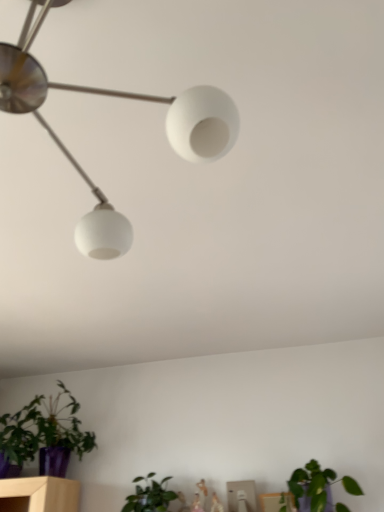
You are a GUI agent. You are given a task and a screenshot of the screen. Output one action in this format:
    pyautogui.click(x=<x>, y=<y>)
    Task: Click on the matte purple pot at lower left, positioned as the first houseplant in left-to-right order
    The width and height of the screenshot is (384, 512).
    Given the screenshot: What is the action you would take?
    pyautogui.click(x=44, y=434)

The image size is (384, 512). What do you see at coordinates (44, 434) in the screenshot? I see `matte purple pot at lower left, which is counted as the 2th houseplant, starting from the right` at bounding box center [44, 434].

Locate an element on the screen. green matte plant at lower right, the first houseplant from the right is located at coordinates (318, 486).

In order to face green matte plant at lower right, the first houseplant from the right, should I rotate leftwards or rightwards?

Rotate right and turn 16.566 degrees.

Image resolution: width=384 pixels, height=512 pixels. What do you see at coordinates (318, 486) in the screenshot?
I see `green matte plant at lower right, the first houseplant from the right` at bounding box center [318, 486].

Where is `matte purple pot at lower left, which is counted as the 2th houseplant, starting from the right`? Image resolution: width=384 pixels, height=512 pixels. matte purple pot at lower left, which is counted as the 2th houseplant, starting from the right is located at coordinates (44, 434).

Is matte purple pot at lower left, positioned as the first houseplant in left-to-right order, to the right of green matte plant at lower right, the first houseplant from the right, from the viewer's perspective?

Incorrect, matte purple pot at lower left, positioned as the first houseplant in left-to-right order, is not on the right side of green matte plant at lower right, the first houseplant from the right.

Does matte purple pot at lower left, positioned as the first houseplant in left-to-right order, lie in front of green matte plant at lower right, which is counted as the second houseplant, starting from the left?

No, it is not.

Considering the points (68, 435) and (316, 498), which point is in front, point (68, 435) or point (316, 498)?

Positioned in front is point (316, 498).

In the scene shown: From the image's perspective, is matte purple pot at lower left, positioned as the first houseplant in left-to-right order, below green matte plant at lower right, the first houseplant from the right?

Actually, matte purple pot at lower left, positioned as the first houseplant in left-to-right order, appears above green matte plant at lower right, the first houseplant from the right, in the image.

From a real-world perspective, which object stands above the other?

In real-world perspective, matte purple pot at lower left, positioned as the first houseplant in left-to-right order, is above.

Considering the relative sizes of matte purple pot at lower left, positioned as the first houseplant in left-to-right order, and green matte plant at lower right, the first houseplant from the right, in the image provided, is matte purple pot at lower left, positioned as the first houseplant in left-to-right order, wider than green matte plant at lower right, the first houseplant from the right,?

Indeed, matte purple pot at lower left, positioned as the first houseplant in left-to-right order, has a greater width compared to green matte plant at lower right, the first houseplant from the right.

Is matte purple pot at lower left, which is counted as the 2th houseplant, starting from the right, shorter than green matte plant at lower right, the first houseplant from the right?

No.

Consider the image. Is matte purple pot at lower left, which is counted as the 2th houseplant, starting from the right, smaller than green matte plant at lower right, which is counted as the second houseplant, starting from the left?

Actually, matte purple pot at lower left, which is counted as the 2th houseplant, starting from the right, might be larger than green matte plant at lower right, which is counted as the second houseplant, starting from the left.

Is matte purple pot at lower left, which is counted as the 2th houseplant, starting from the right, not within green matte plant at lower right, the first houseplant from the right?

matte purple pot at lower left, which is counted as the 2th houseplant, starting from the right, lies outside green matte plant at lower right, the first houseplant from the right,'s area.

Is matte purple pot at lower left, which is counted as the 2th houseplant, starting from the right, next to green matte plant at lower right, the first houseplant from the right, and touching it?

matte purple pot at lower left, which is counted as the 2th houseplant, starting from the right, and green matte plant at lower right, the first houseplant from the right, are clearly separated.

Could you tell me if matte purple pot at lower left, positioned as the first houseplant in left-to-right order, is facing green matte plant at lower right, which is counted as the second houseplant, starting from the left?

No, matte purple pot at lower left, positioned as the first houseplant in left-to-right order, is not turned towards green matte plant at lower right, which is counted as the second houseplant, starting from the left.

How many degrees apart are the facing directions of matte purple pot at lower left, positioned as the first houseplant in left-to-right order, and green matte plant at lower right, the first houseplant from the right?

The facing directions of matte purple pot at lower left, positioned as the first houseplant in left-to-right order, and green matte plant at lower right, the first houseplant from the right, are 0.000857 degrees apart.

Image resolution: width=384 pixels, height=512 pixels. I want to click on houseplant that appears above the green matte plant at lower right, which is counted as the second houseplant, starting from the left (from a real-world perspective), so click(x=44, y=434).

Which is more to the left, green matte plant at lower right, which is counted as the second houseplant, starting from the left, or matte purple pot at lower left, which is counted as the 2th houseplant, starting from the right?

Positioned to the left is matte purple pot at lower left, which is counted as the 2th houseplant, starting from the right.

Does green matte plant at lower right, the first houseplant from the right, come behind matte purple pot at lower left, which is counted as the 2th houseplant, starting from the right?

No, it is not.

Is point (356, 493) positioned in front of point (72, 416)?

Yes, it is.

Based on the photo, from the image's perspective, does green matte plant at lower right, which is counted as the second houseplant, starting from the left, appear higher than matte purple pot at lower left, positioned as the first houseplant in left-to-right order?

Incorrect, from the image's perspective, green matte plant at lower right, which is counted as the second houseplant, starting from the left, is lower than matte purple pot at lower left, positioned as the first houseplant in left-to-right order.

From a real-world perspective, who is located lower, green matte plant at lower right, which is counted as the second houseplant, starting from the left, or matte purple pot at lower left, positioned as the first houseplant in left-to-right order?

green matte plant at lower right, which is counted as the second houseplant, starting from the left, is physically lower.

Is green matte plant at lower right, which is counted as the second houseplant, starting from the left, wider than matte purple pot at lower left, which is counted as the 2th houseplant, starting from the right?

In fact, green matte plant at lower right, which is counted as the second houseplant, starting from the left, might be narrower than matte purple pot at lower left, which is counted as the 2th houseplant, starting from the right.

Considering the relative sizes of green matte plant at lower right, which is counted as the second houseplant, starting from the left, and matte purple pot at lower left, positioned as the first houseplant in left-to-right order, in the image provided, is green matte plant at lower right, which is counted as the second houseplant, starting from the left, taller than matte purple pot at lower left, positioned as the first houseplant in left-to-right order,?

Incorrect, the height of green matte plant at lower right, which is counted as the second houseplant, starting from the left, is not larger of that of matte purple pot at lower left, positioned as the first houseplant in left-to-right order.

Considering the relative sizes of green matte plant at lower right, which is counted as the second houseplant, starting from the left, and matte purple pot at lower left, which is counted as the 2th houseplant, starting from the right, in the image provided, is green matte plant at lower right, which is counted as the second houseplant, starting from the left, smaller than matte purple pot at lower left, which is counted as the 2th houseplant, starting from the right,?

Indeed, green matte plant at lower right, which is counted as the second houseplant, starting from the left, has a smaller size compared to matte purple pot at lower left, which is counted as the 2th houseplant, starting from the right.

Is green matte plant at lower right, which is counted as the second houseplant, starting from the left, located outside matte purple pot at lower left, which is counted as the 2th houseplant, starting from the right?

Absolutely, green matte plant at lower right, which is counted as the second houseplant, starting from the left, is external to matte purple pot at lower left, which is counted as the 2th houseplant, starting from the right.

Is green matte plant at lower right, the first houseplant from the right, directly adjacent to matte purple pot at lower left, which is counted as the 2th houseplant, starting from the right?

There is a gap between green matte plant at lower right, the first houseplant from the right, and matte purple pot at lower left, which is counted as the 2th houseplant, starting from the right.

Is green matte plant at lower right, which is counted as the second houseplant, starting from the left, looking in the opposite direction of matte purple pot at lower left, positioned as the first houseplant in left-to-right order?

green matte plant at lower right, which is counted as the second houseplant, starting from the left, does not have its back to matte purple pot at lower left, positioned as the first houseplant in left-to-right order.

Image resolution: width=384 pixels, height=512 pixels. I want to click on houseplant lying in front of the matte purple pot at lower left, positioned as the first houseplant in left-to-right order, so click(x=318, y=486).

Identify the location of houseplant behind the green matte plant at lower right, the first houseplant from the right. (44, 434).

I want to click on houseplant on the right of matte purple pot at lower left, positioned as the first houseplant in left-to-right order, so click(x=318, y=486).